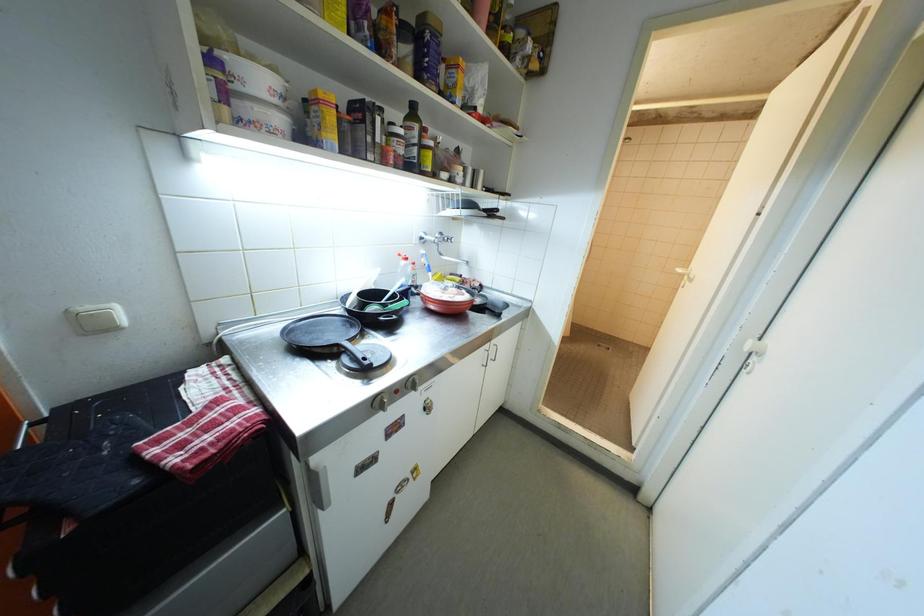
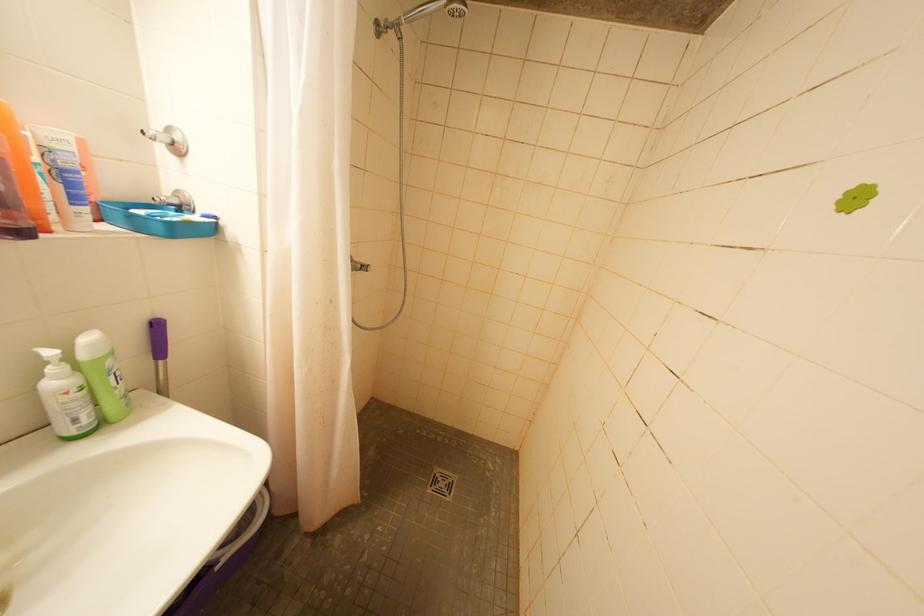
In a continuous first-person perspective shot, in which direction is the camera moving?

The movement direction of the cameraman is right, forward.